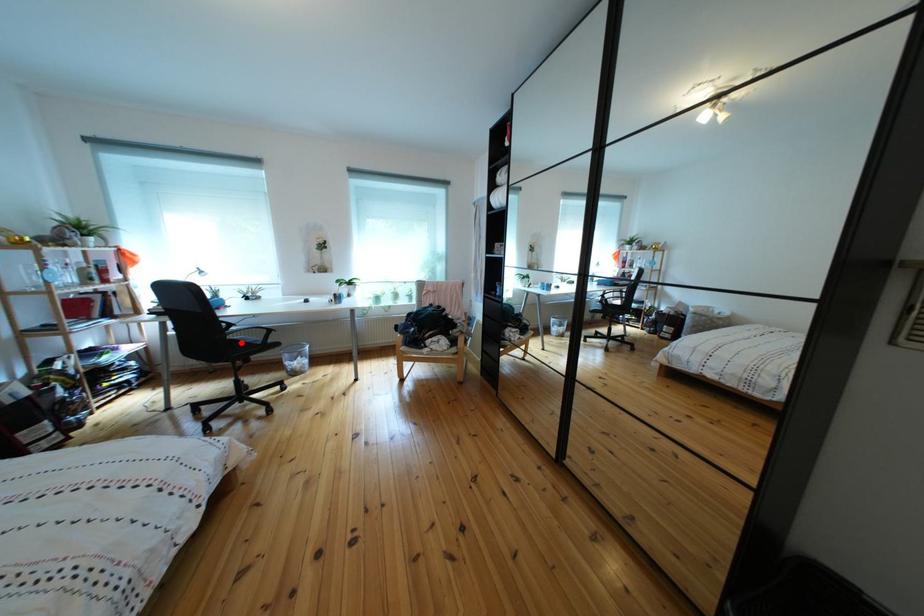
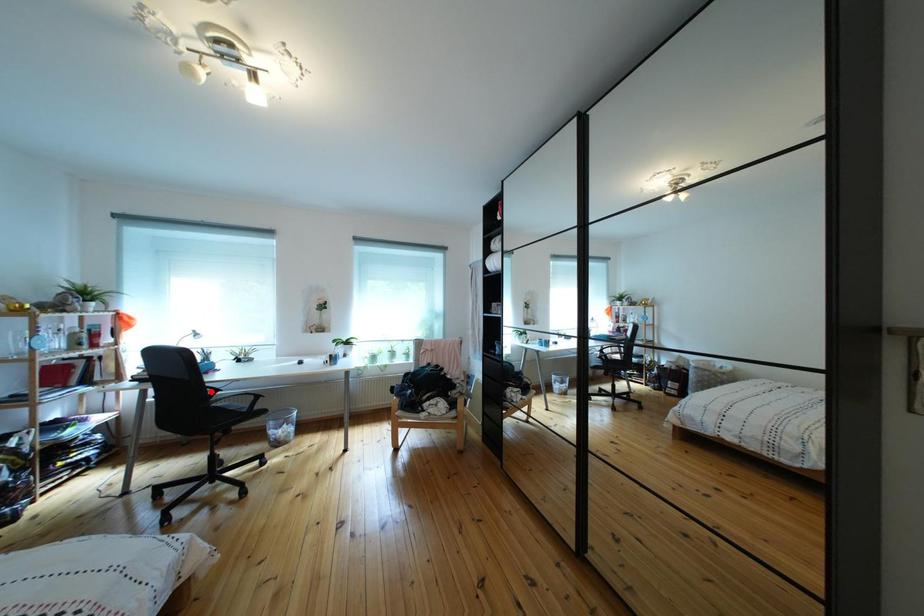
I am providing you with two images of the same scene from different viewpoints. A red point is marked on the first image and another point is marked on the second image. Is the marked point in image1 the same physical position as the marked point in image2?

No